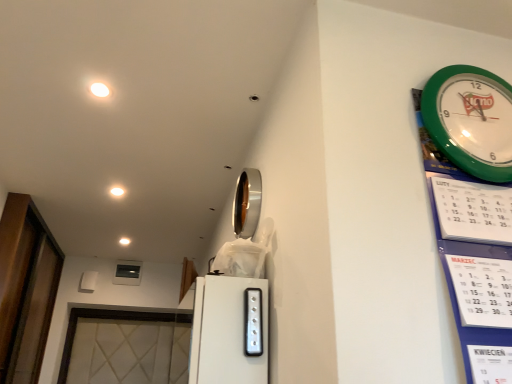
Question: Looking at their shapes, would you say transparent glass door at left is wider or thinner than white glossy light at upper center, the first light when ordered from left to right?

Choices:
 (A) wide
 (B) thin

Answer: (A)

Question: From the image's perspective, is transparent glass door at left above or below white glossy light at upper center, the first light when ordered from left to right?

Choices:
 (A) below
 (B) above

Answer: (A)

Question: Estimate the real-world distances between objects in this image. Which object is closer to the transparent glass door at left?

Choices:
 (A) white glossy light at upper left, which is the 3th light in bottom-to-top order
 (B) satin silver switch at center
 (C) green plastic wall clock at upper right
 (D) silver/metallic mirror at upper center
 (E) white glossy light at upper center, the third light when ordered from top to bottom

Answer: (E)

Question: Which is farther from the satin silver switch at center?

Choices:
 (A) transparent glass door at left
 (B) white glossy light at upper left, which is the 3th light in bottom-to-top order
 (C) white glossy light at upper center, arranged as the 3th light when viewed from the front
 (D) silver/metallic mirror at upper center
 (E) green plastic wall clock at upper right

Answer: (A)